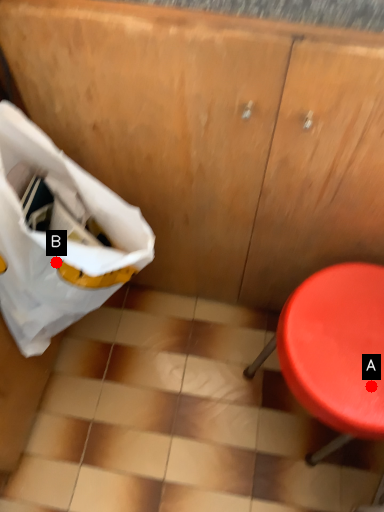
Question: Two points are circled on the image, labeled by A and B beside each circle. Which point is farther from the camera taking this photo?

Choices:
 (A) A is further
 (B) B is further

Answer: (B)